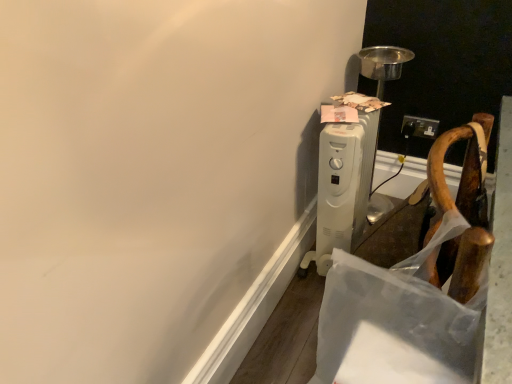
At what (x,y) coordinates should I click in order to perform the action: click on white plastic heater at right. Please return your answer as a coordinate pair (x, y). Image resolution: width=512 pixels, height=384 pixels. Looking at the image, I should click on (343, 187).

In order to face white plastic heater at right, should I rotate leftwards or rightwards?

To align with it, rotate right about 12.012°.

Describe the element at coordinates (343, 187) in the screenshot. The image size is (512, 384). I see `white plastic heater at right` at that location.

This screenshot has height=384, width=512. What are the coordinates of `white plastic heater at right` in the screenshot? It's located at 343,187.